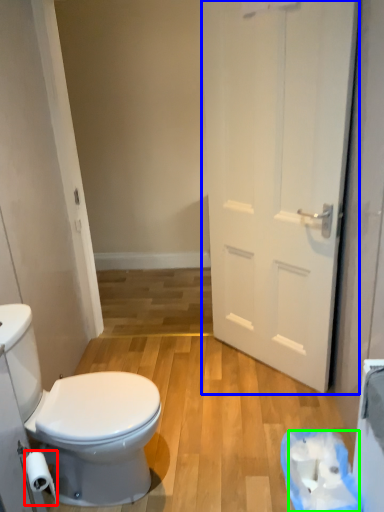
Question: Which object is positioned closest to toilet paper (highlighted by a red box)? Select from door (highlighted by a blue box) and toilet paper (highlighted by a green box).

Choices:
 (A) door
 (B) toilet paper

Answer: (B)